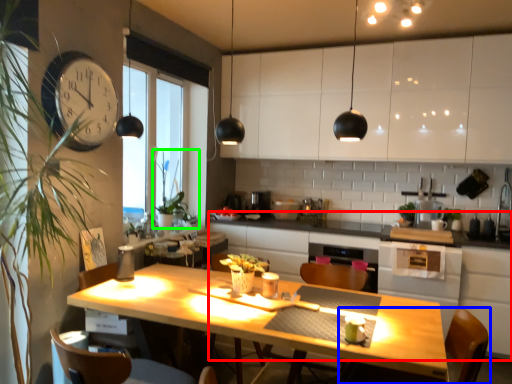
Question: Which object is positioned closest to counter (highlighted by a red box)? Select from chair (highlighted by a blue box) and plant (highlighted by a green box).

Choices:
 (A) chair
 (B) plant

Answer: (B)